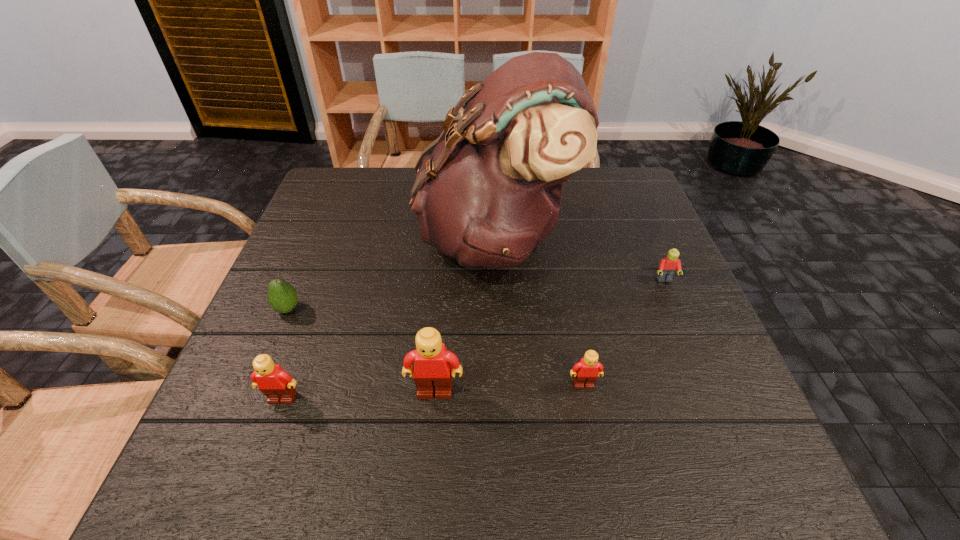
I want to click on the third shortest Lego, so click(x=278, y=386).

Where is `the leftmost Lego`? This screenshot has width=960, height=540. the leftmost Lego is located at coordinates (278, 386).

Locate an element on the screen. Image resolution: width=960 pixels, height=540 pixels. the tallest Lego is located at coordinates (432, 369).

This screenshot has width=960, height=540. I want to click on the third Lego from right to left, so click(x=432, y=369).

At what (x,y) coordinates should I click in order to perform the action: click on the third Lego from left to right. Please return your answer as a coordinate pair (x, y). Looking at the image, I should click on (586, 372).

You are a GUI agent. You are given a task and a screenshot of the screen. Output one action in this format:
    pyautogui.click(x=<x>, y=<y>)
    Task: Click on the satchel
    This screenshot has width=960, height=540.
    Given the screenshot: What is the action you would take?
    pyautogui.click(x=488, y=190)

Locate an element on the screen. The width and height of the screenshot is (960, 540). avocado is located at coordinates (282, 296).

This screenshot has width=960, height=540. In order to click on the farthest Lego in this screenshot , I will do `click(667, 268)`.

At what (x,y) coordinates should I click in order to perform the action: click on the rightmost Lego. Please return your answer as a coordinate pair (x, y). This screenshot has width=960, height=540. Looking at the image, I should click on (667, 268).

This screenshot has height=540, width=960. Find the location of `vacant point located at the front of the tallest object with buckles`. vacant point located at the front of the tallest object with buckles is located at coordinates (315, 238).